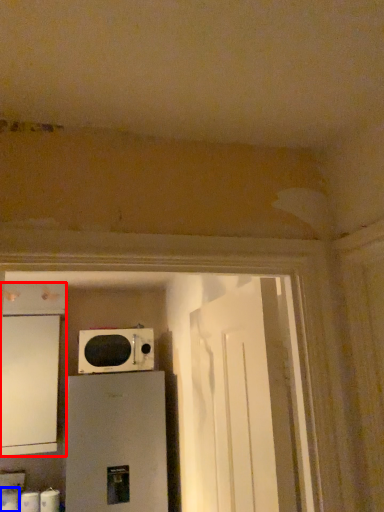
Question: Which of the following is the farthest to the observer, cabinetry (highlighted by a red box) or toilet paper (highlighted by a blue box)?

Choices:
 (A) cabinetry
 (B) toilet paper

Answer: (B)